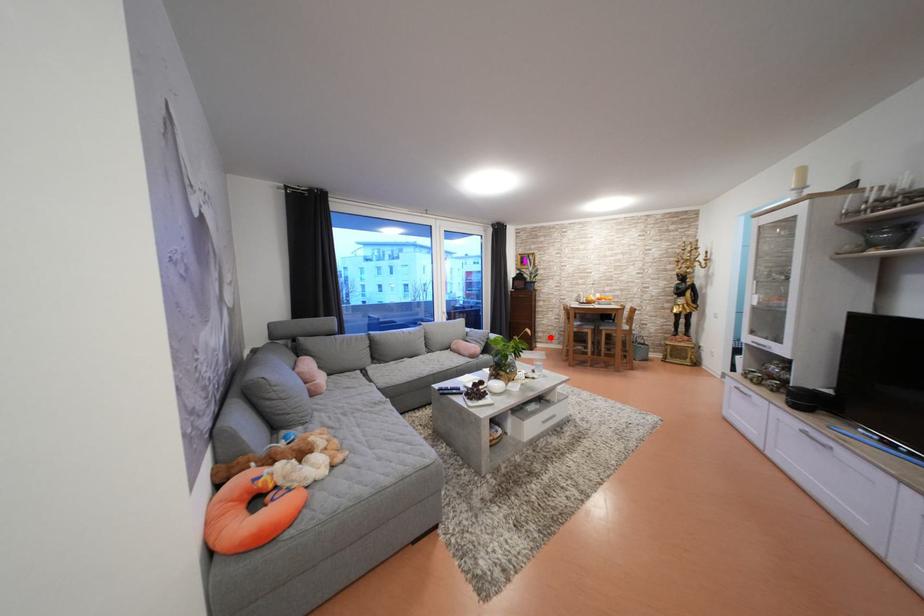
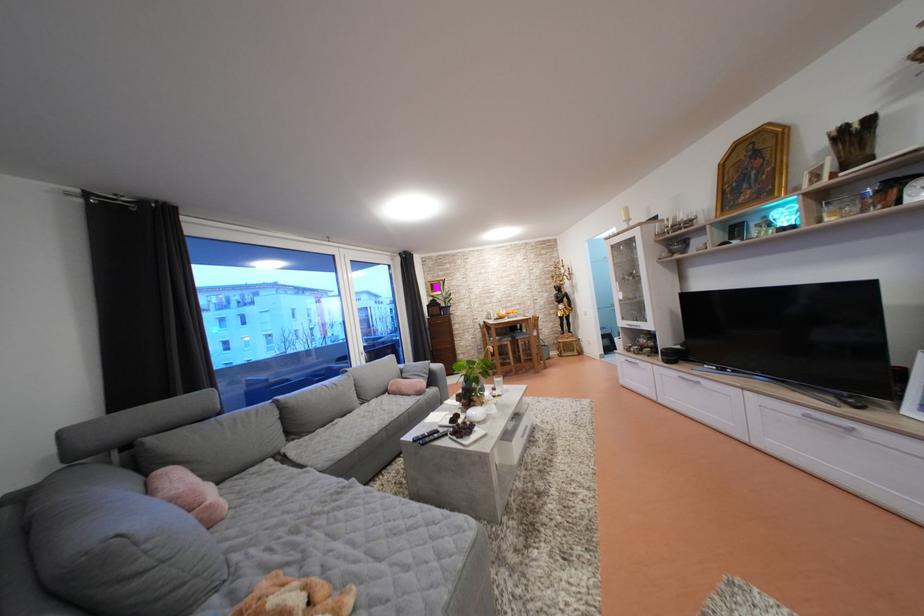
Find the pixel in the second image that matches the highlighted location in the first image.

(470, 359)